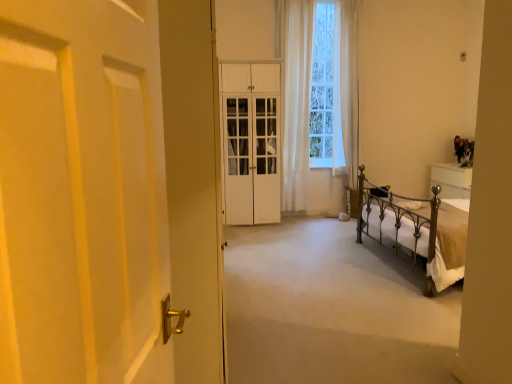
At what (x,y) coordinates should I click in order to perform the action: click on free space on the front side of white glossy cabinet at center. Please return your answer as a coordinate pair (x, y). Looking at the image, I should click on (264, 239).